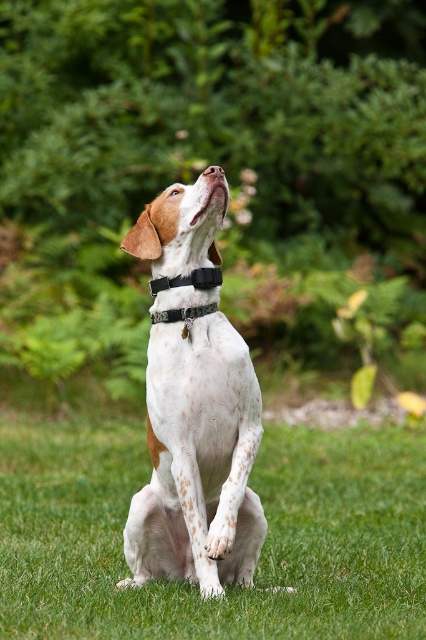
You are a photographer setting up a shot of the dog. You need to place a small prop on the green grass at center so it doesn not get covered by the black fabric neckband at center. Which object has a wider area to place the prop?

The green grass at center has a wider area than the black fabric neckband at center, so place the prop on the green grass at center to avoid coverage.

From the picture: You are a drone operator trying to capture a photo of the dog. The drone is currently hovering at point (x=259, y=556). To get a clear shot of the dog, should you move the drone north or south?

The point (x=259, y=556) is where the green grass at center is located. Since the dog is sitting on the green grass at center, you should not move the drone north or south because the drone is already positioned over the dog.